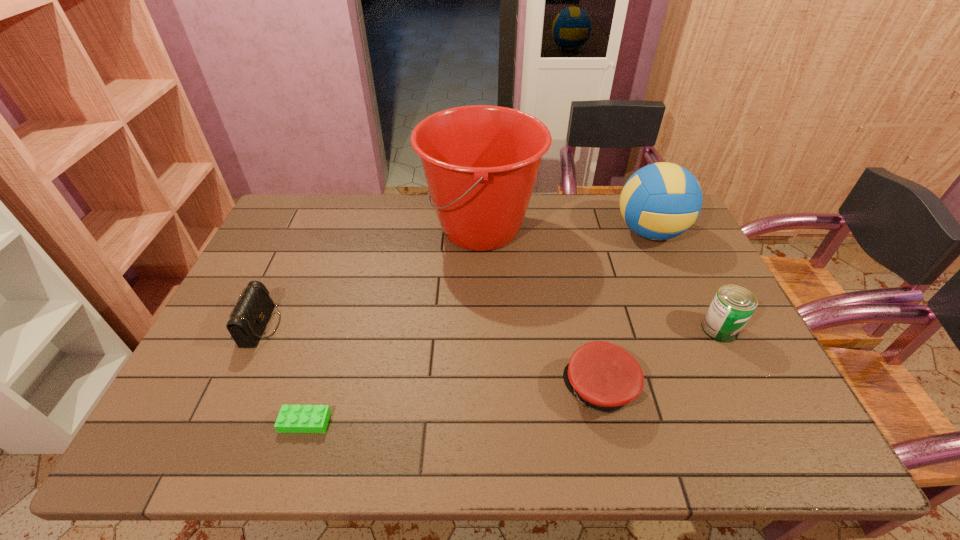
At what (x,y) coordinates should I click in order to perform the action: click on cap located at the near edge. Please return your answer as a coordinate pair (x, y). The height and width of the screenshot is (540, 960). Looking at the image, I should click on (603, 376).

Identify the location of Lego present at the near edge. This screenshot has height=540, width=960. (292, 418).

The height and width of the screenshot is (540, 960). What are the coordinates of `object that is positioned at the left edge` in the screenshot? It's located at (253, 309).

Identify the location of volleyball at the right edge. This screenshot has width=960, height=540. (660, 201).

Where is `can that is at the right edge`? can that is at the right edge is located at coordinates (733, 305).

Find the location of a particular element. This screenshot has height=540, width=960. object that is at the far right corner is located at coordinates (660, 201).

The height and width of the screenshot is (540, 960). Find the location of `vacant space at the far edge of the desktop`. vacant space at the far edge of the desktop is located at coordinates (381, 224).

Find the location of `vacant space at the near edge of the desktop`. vacant space at the near edge of the desktop is located at coordinates (612, 442).

In the image, there is a desktop. At what (x,y) coordinates should I click in order to perform the action: click on blank space at the left edge. Please return your answer as a coordinate pair (x, y). Looking at the image, I should click on (295, 285).

The height and width of the screenshot is (540, 960). Find the location of `free space at the right edge of the desktop`. free space at the right edge of the desktop is located at coordinates 694,334.